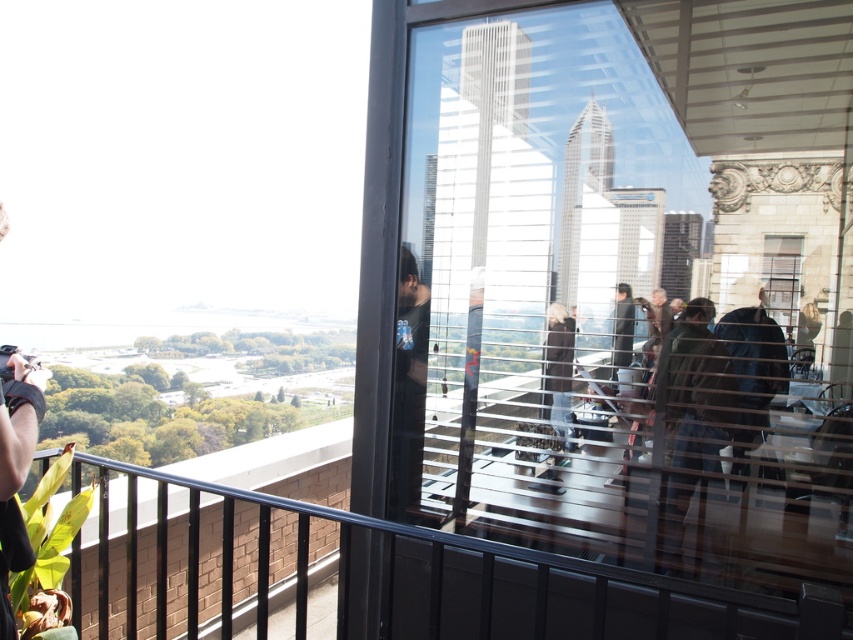
You are organizing a charity event and need to hang two jackets on a coat rack. The dark brown leather jacket at center and the dark blue jacket at right are available. Which jacket requires more space on the coat rack?

The dark brown leather jacket at center requires more space on the coat rack because it is larger in size than the dark blue jacket at right.

You are standing inside the building and looking through the large window. There is a point marked at coordinates (393, 579). Which object from the scene does this point belong to?

The point at coordinates (393, 579) is on the black metal balustrade at lower left.